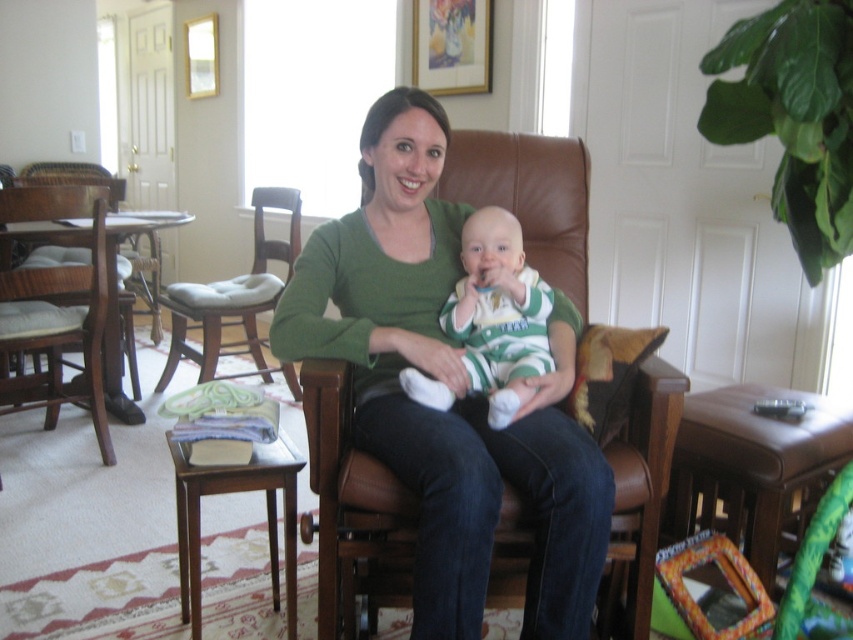
Can you confirm if green matte shirt at center is shorter than striped cotton onesie at center?

Incorrect, green matte shirt at center's height does not fall short of striped cotton onesie at center's.

Between green matte shirt at center and striped cotton onesie at center, which one has less height?

striped cotton onesie at center

Find the location of a particular element. green matte shirt at center is located at coordinates (450, 387).

Is striped cotton onesie at center positioned behind brown wood chair at left?

No, it is in front of brown wood chair at left.

Does striped cotton onesie at center have a smaller size compared to brown wood chair at left?

Yes.

The height and width of the screenshot is (640, 853). What are the coordinates of `striped cotton onesie at center` in the screenshot? It's located at (498, 314).

Identify the location of striped cotton onesie at center. Image resolution: width=853 pixels, height=640 pixels. (498, 314).

Is striped cotton onesie at center positioned in front of wooden cushioned chair at center?

Yes, striped cotton onesie at center is closer to the viewer.

Who is positioned more to the right, striped cotton onesie at center or wooden cushioned chair at center?

From the viewer's perspective, striped cotton onesie at center appears more on the right side.

Who is more distant from viewer, (463, 264) or (288, 273)?

The point (288, 273) is behind.

This screenshot has width=853, height=640. I want to click on striped cotton onesie at center, so click(498, 314).